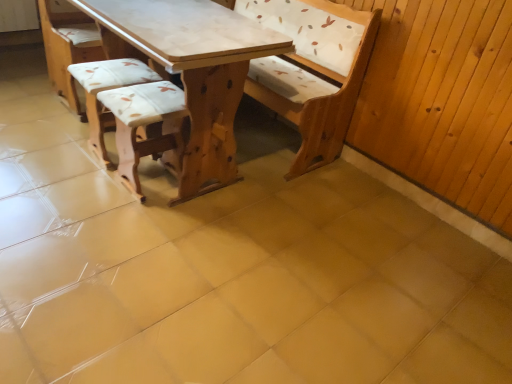
The height and width of the screenshot is (384, 512). Identify the location of vacant position to the left of wooden textured stool at center, which is the first armchair in right-to-left order. tap(77, 182).